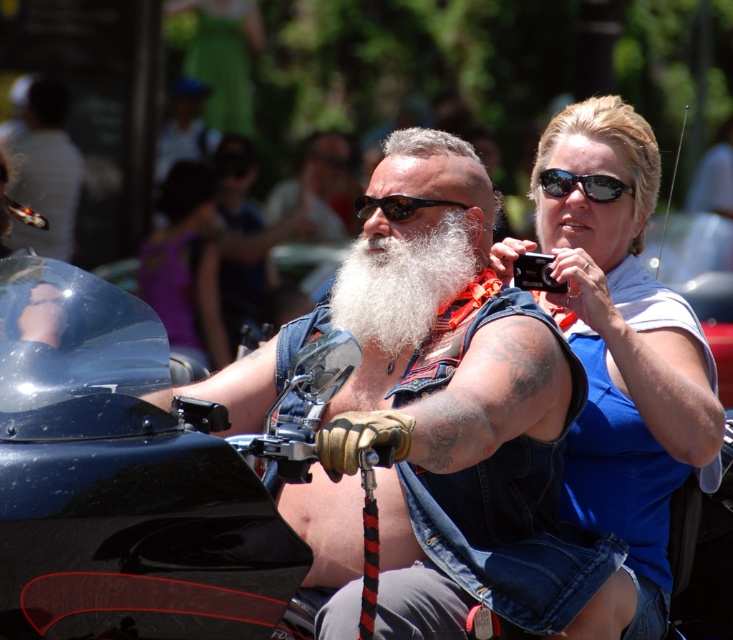
You are a photographer trying to capture the blue denim tank top at upper right and the black plastic sunglasses at upper right in a single frame. Based on their positions, which one is closer to the bottom edge of the photo?

The blue denim tank top at upper right is below the black plastic sunglasses at upper right, so it is closer to the bottom edge of the photo.